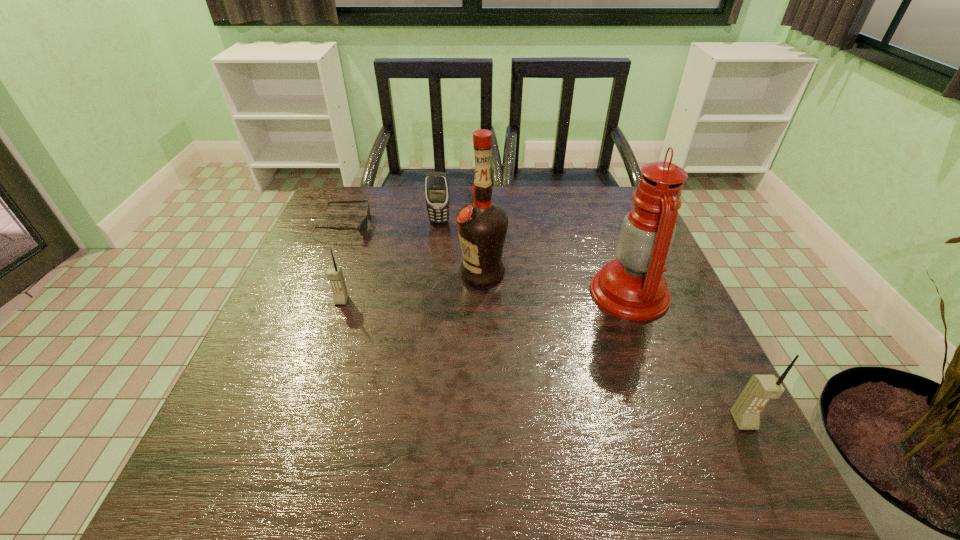
Identify the location of empty space between the shortest object and the third tallest object. (543, 323).

Identify the location of vacant point located between the rightmost object and the second cellular telephone from left to right. Image resolution: width=960 pixels, height=540 pixels. (591, 321).

At what (x,y) coordinates should I click in order to perform the action: click on vacant space that is in between the rightmost object and the oil lamp. Please return your answer as a coordinate pair (x, y). The image size is (960, 540). Looking at the image, I should click on 686,357.

Locate an element on the screen. This screenshot has height=540, width=960. free spot between the third object from right to left and the shortest object is located at coordinates (413, 249).

Image resolution: width=960 pixels, height=540 pixels. I want to click on free space between the leftmost cellular telephone and the sunglasses, so click(x=343, y=263).

The height and width of the screenshot is (540, 960). In order to click on free point between the fourth object from left to right and the oil lamp in this screenshot , I will do `click(556, 283)`.

Find the location of a particular element. Image resolution: width=960 pixels, height=540 pixels. free space that is in between the oil lamp and the nearest object is located at coordinates (686, 357).

The width and height of the screenshot is (960, 540). I want to click on free area in between the sunglasses and the third tallest object, so click(543, 323).

Where is `vacant space that is in between the fourth object from right to left and the fourth object from left to right`? vacant space that is in between the fourth object from right to left and the fourth object from left to right is located at coordinates (461, 247).

Find the location of a particular element. free area in between the farthest cellular telephone and the liquor is located at coordinates (461, 247).